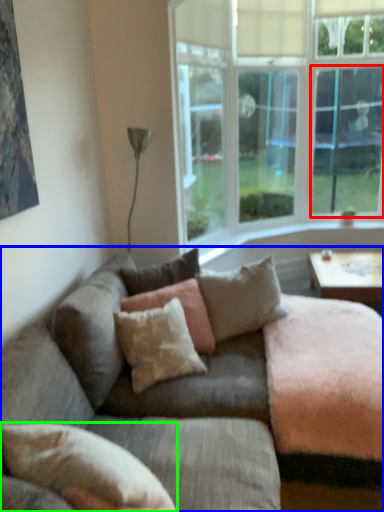
Question: Estimate the real-world distances between objects in this image. Which object is closer to window screen (highlighted by a red box), studio couch (highlighted by a blue box) or pillow (highlighted by a green box)?

Choices:
 (A) studio couch
 (B) pillow

Answer: (A)